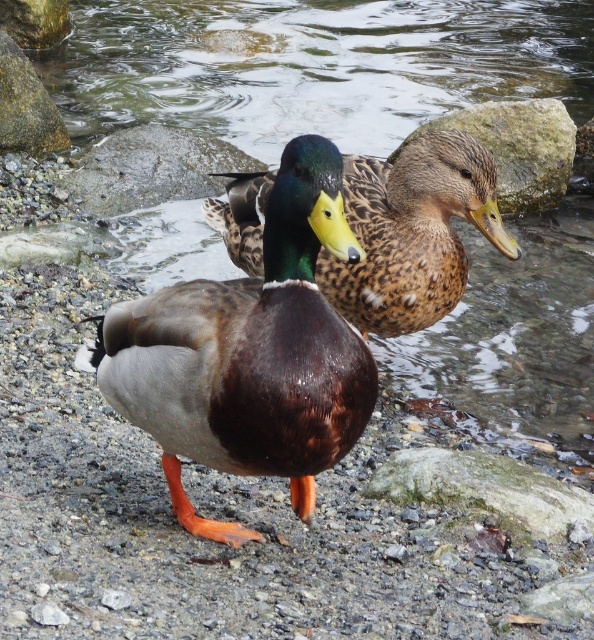
Is shiny brown duck at center behind gray rock at center?

No.

Is shiny brown duck at center to the right of gray rock at center from the viewer's perspective?

Indeed, shiny brown duck at center is positioned on the right side of gray rock at center.

Locate an element on the screen. The width and height of the screenshot is (594, 640). shiny brown duck at center is located at coordinates (249, 353).

Where is `shiny brown duck at center`? The image size is (594, 640). shiny brown duck at center is located at coordinates (249, 353).

Is brown matte duck at center to the left of shiny brown duck at center from the viewer's perspective?

Yes, brown matte duck at center is to the left of shiny brown duck at center.

Between point (470, 336) and point (333, 436), which one is positioned in front?

Point (333, 436)

This screenshot has height=640, width=594. I want to click on brown matte duck at center, so (312, 65).

Can you confirm if gray rock at center is wider than smooth gray rock at upper left?

Yes, gray rock at center is wider than smooth gray rock at upper left.

Is point (96, 160) behind point (33, 140)?

Yes, point (96, 160) is behind point (33, 140).

Who is more distant from viewer, (127, 186) or (26, 104)?

The point (26, 104) is behind.

At what (x,y) coordinates should I click in order to perform the action: click on gray rock at center. Please return your answer as a coordinate pair (x, y). Image resolution: width=594 pixels, height=640 pixels. Looking at the image, I should click on (150, 168).